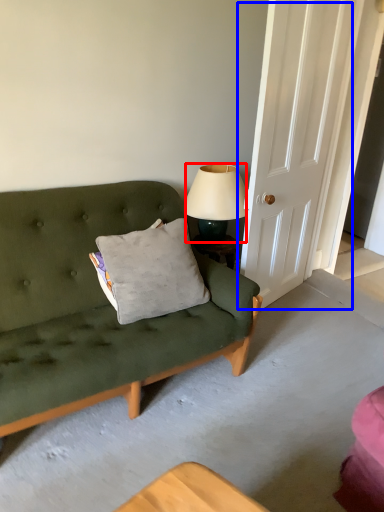
Question: Which object is further to the camera taking this photo, lamp (highlighted by a red box) or door (highlighted by a blue box)?

Choices:
 (A) lamp
 (B) door

Answer: (A)